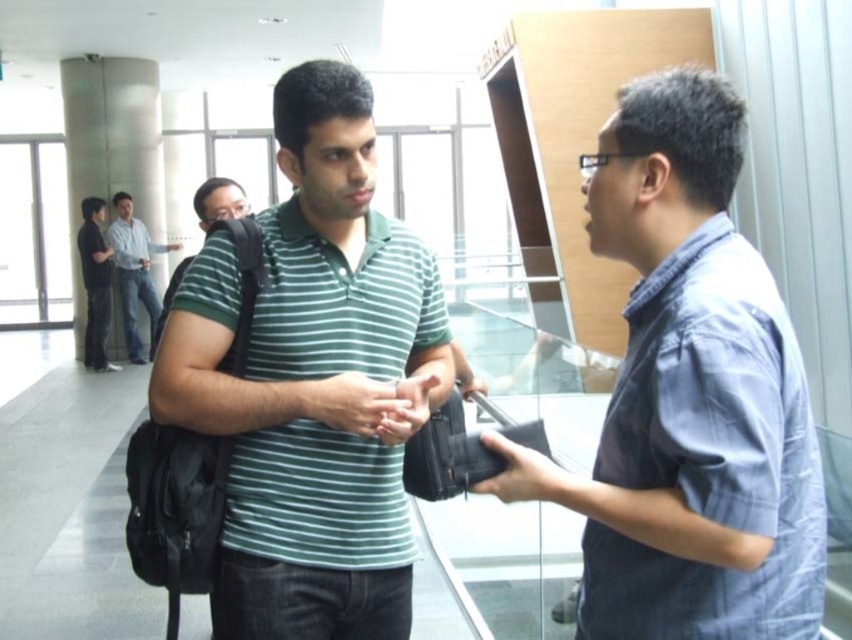
Does green striped polo shirt at center have a smaller size compared to matte green shirt at center?

Actually, green striped polo shirt at center might be larger than matte green shirt at center.

Does green striped polo shirt at center appear on the left side of matte green shirt at center?

Indeed, green striped polo shirt at center is positioned on the left side of matte green shirt at center.

Where is `green striped polo shirt at center`? green striped polo shirt at center is located at coordinates (309, 380).

Between blue denim shirt at center and dark gray pants at left, which one appears on the right side from the viewer's perspective?

From the viewer's perspective, blue denim shirt at center appears more on the right side.

Is blue denim shirt at center bigger than dark gray pants at left?

Actually, blue denim shirt at center might be smaller than dark gray pants at left.

Between point (628, 163) and point (96, 298), which one is positioned behind?

Positioned behind is point (96, 298).

The image size is (852, 640). In order to click on blue denim shirt at center in this screenshot , I will do `click(688, 396)`.

Between point (280, 243) and point (142, 230), which one is positioned behind?

Point (142, 230)

Is point (286, 604) more distant than point (137, 221)?

No.

Locate an element on the screen. The width and height of the screenshot is (852, 640). green striped polo shirt at center is located at coordinates (309, 380).